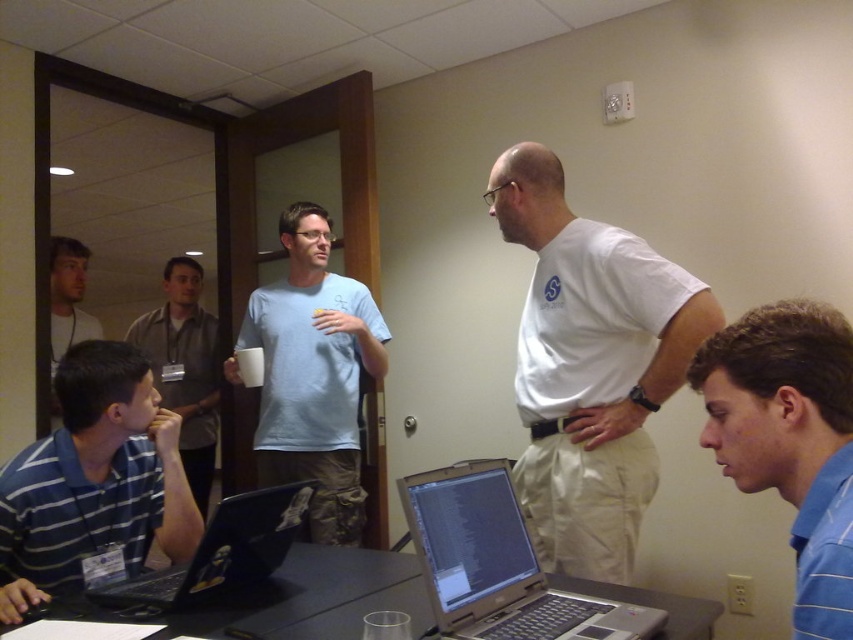
Which is below, light blue t-shirt at center or black plastic table at center?

black plastic table at center

What do you see at coordinates (314, 374) in the screenshot? The width and height of the screenshot is (853, 640). I see `light blue t-shirt at center` at bounding box center [314, 374].

Does point (363, 344) come behind point (305, 596)?

That is True.

I want to click on light blue t-shirt at center, so click(x=314, y=374).

Can you confirm if white cotton shirt at center is taller than light blue t-shirt at center?

Incorrect, white cotton shirt at center's height is not larger of light blue t-shirt at center's.

In order to click on white cotton shirt at center in this screenshot , I will do `click(590, 365)`.

Where is `white cotton shirt at center`? This screenshot has width=853, height=640. white cotton shirt at center is located at coordinates pos(590,365).

The width and height of the screenshot is (853, 640). What are the coordinates of `white cotton shirt at center` in the screenshot? It's located at (590, 365).

Is point (207, 490) farther from camera compared to point (86, 333)?

Yes, it is.

Which of these two, gray fabric shirt at left or matte gray shirt at upper left, stands taller?

With more height is gray fabric shirt at left.

Image resolution: width=853 pixels, height=640 pixels. Find the location of `gray fabric shirt at left`. gray fabric shirt at left is located at coordinates (184, 369).